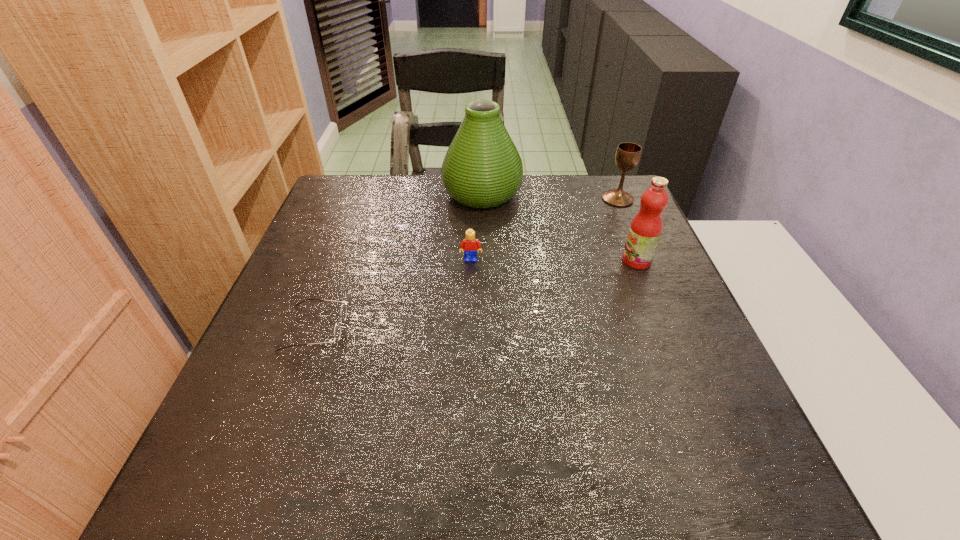
Where is `the tallest object`? the tallest object is located at coordinates (482, 169).

This screenshot has height=540, width=960. In order to click on fruit juice in this screenshot , I will do `click(646, 227)`.

The height and width of the screenshot is (540, 960). What are the coordinates of `chalice` in the screenshot? It's located at (627, 156).

I want to click on Lego, so click(x=470, y=243).

Where is `the leftmost object`? the leftmost object is located at coordinates (337, 330).

Image resolution: width=960 pixels, height=540 pixels. I want to click on the shortest object, so click(337, 330).

Locate an element on the screen. The width and height of the screenshot is (960, 540). vacant position located 0.100m on the front of the tallest object is located at coordinates (483, 238).

The width and height of the screenshot is (960, 540). I want to click on free space located on the front label of the second tallest object, so click(x=573, y=261).

The height and width of the screenshot is (540, 960). What are the coordinates of `vacant area located 0.140m on the front label of the second tallest object` in the screenshot? It's located at (564, 261).

The image size is (960, 540). I want to click on vacant space situated 0.170m on the front label of the second tallest object, so click(552, 261).